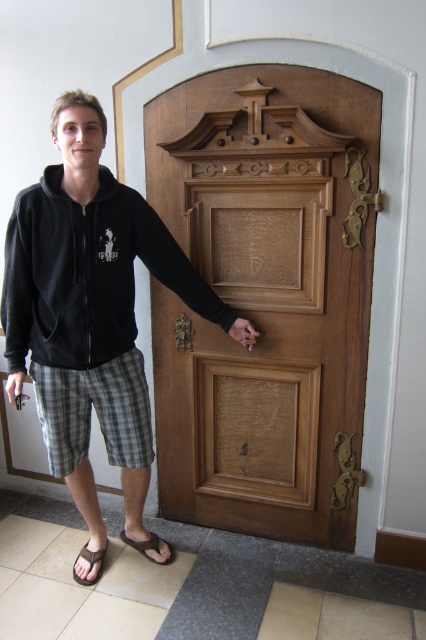
Based on the photo, you are an interior designer assessing the space in the image. The wooden carved door at center and the black cotton hoodie at center are both in view. Which object has a greater width?

The black cotton hoodie at center has a greater width than the wooden carved door at center according to the description.

You are a painter who needs to paint the wooden carved door at center and the black rubber sandal at lower left. Which object requires more vertical space for painting?

The wooden carved door at center requires more vertical space for painting since it has a greater height compared to the black rubber sandal at lower left.